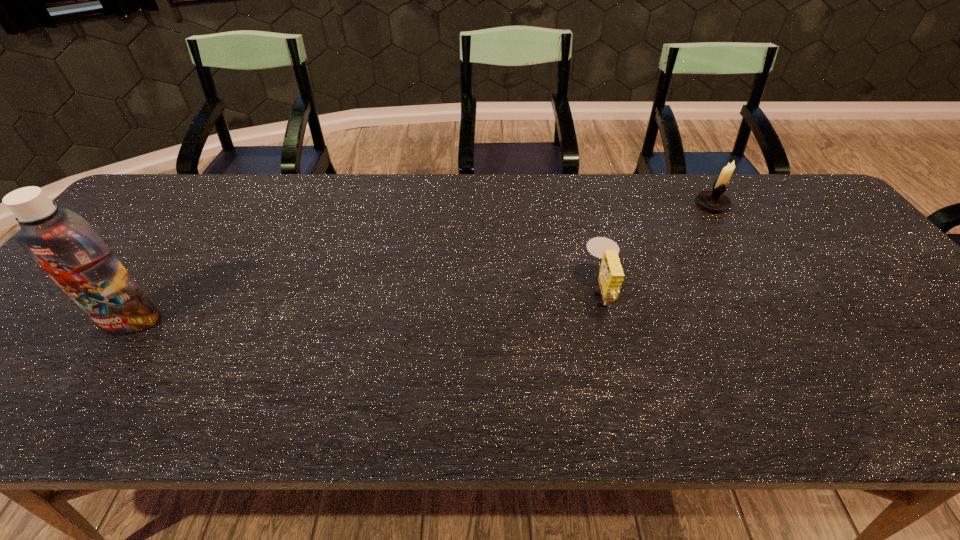
Locate an element on the screen. This screenshot has width=960, height=540. free space between the rightmost object and the second object from right to left is located at coordinates (657, 248).

Locate an element on the screen. This screenshot has height=540, width=960. vacant space that's between the rightmost object and the sponge is located at coordinates [657, 248].

Where is `vacant area that lies between the shortest object and the farthest object`? This screenshot has width=960, height=540. vacant area that lies between the shortest object and the farthest object is located at coordinates (657, 248).

At what (x,y) coordinates should I click in order to perform the action: click on blank region between the tallest object and the second shortest object. Please return your answer as a coordinate pair (x, y). This screenshot has height=540, width=960. Looking at the image, I should click on (421, 262).

Locate an element on the screen. vacant area that lies between the leftmost object and the shortest object is located at coordinates (366, 306).

The height and width of the screenshot is (540, 960). In order to click on vacant area that lies between the tallest object and the second shortest object in this screenshot , I will do `click(421, 262)`.

In order to click on vacant point located between the tallest object and the second object from left to right in this screenshot , I will do `click(366, 306)`.

What are the coordinates of `object that is the closest to the candle holder` in the screenshot? It's located at (611, 275).

Locate which object is the closest to the second tallest object. Please provide its 2D coordinates. Your answer should be formatted as a tuple, i.e. [(x, y)], where the tuple contains the x and y coordinates of a point satisfying the conditions above.

[(611, 275)]

Locate an element on the screen. This screenshot has height=540, width=960. vacant space that satisfies the following two spatial constraints: 1. on the front side of the farthest object; 2. on the front-facing side of the second object from left to right is located at coordinates (765, 292).